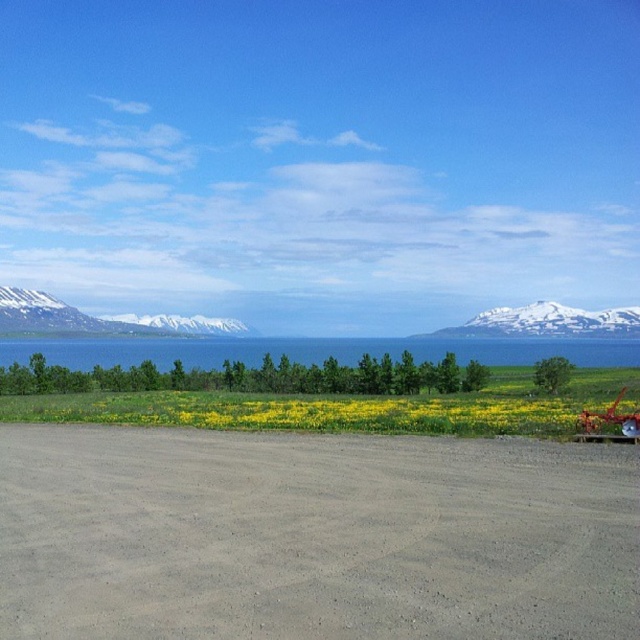
Is blue water at center shorter than snowy rock mountain at upper right?

Yes.

Locate an element on the screen. This screenshot has height=640, width=640. blue water at center is located at coordinates (312, 349).

Can you confirm if gray gravel dirt track at center is bigger than white snow-covered mountain at left?

Incorrect, gray gravel dirt track at center is not larger than white snow-covered mountain at left.

The height and width of the screenshot is (640, 640). Describe the element at coordinates (314, 536) in the screenshot. I see `gray gravel dirt track at center` at that location.

Locate an element on the screen. The height and width of the screenshot is (640, 640). gray gravel dirt track at center is located at coordinates 314,536.

Is blue water at center in front of snowy mountain at center?

Yes, blue water at center is in front of snowy mountain at center.

Is blue water at center above snowy mountain at center?

No.

This screenshot has width=640, height=640. Identify the location of blue water at center. (312, 349).